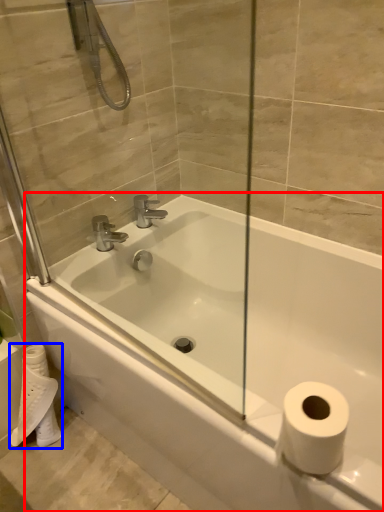
Question: Which of the following is the farthest to the observer, bathtub (highlighted by a red box) or toilet paper (highlighted by a blue box)?

Choices:
 (A) bathtub
 (B) toilet paper

Answer: (B)